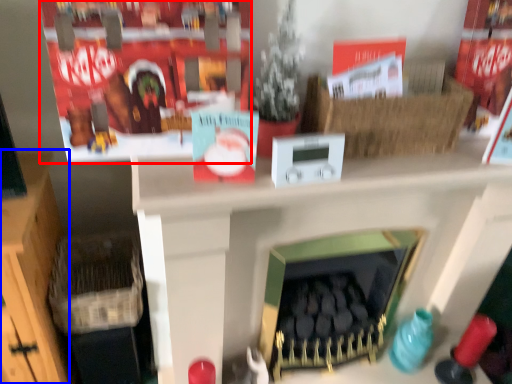
Question: Which of the following is the closest to the observer, shelf (highlighted by a red box) or furniture (highlighted by a blue box)?

Choices:
 (A) shelf
 (B) furniture

Answer: (A)